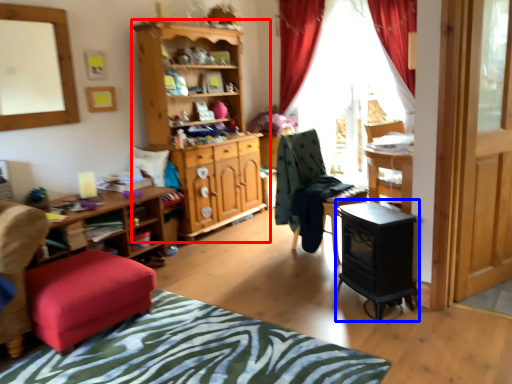
Question: Among these objects, which one is farthest to the camera, cabinetry (highlighted by a red box) or computer desk (highlighted by a blue box)?

Choices:
 (A) cabinetry
 (B) computer desk

Answer: (A)